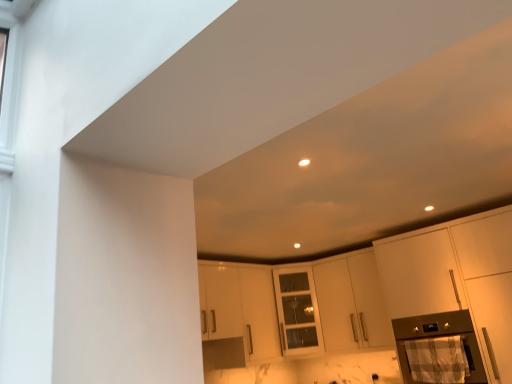
Question: Is metallic stainless steel oven at lower right facing away from matte white cabinet at right, which is the second cabinetry in back-to-front order?

Choices:
 (A) no
 (B) yes

Answer: (B)

Question: Is metallic stainless steel oven at lower right behind matte white cabinet at right, arranged as the 1th cabinetry when viewed from the front?

Choices:
 (A) yes
 (B) no

Answer: (A)

Question: From a real-world perspective, does metallic stainless steel oven at lower right sit lower than matte white cabinet at right, arranged as the 1th cabinetry when viewed from the front?

Choices:
 (A) no
 (B) yes

Answer: (B)

Question: Considering the relative sizes of metallic stainless steel oven at lower right and matte white cabinet at right, which is the second cabinetry in back-to-front order, in the image provided, is metallic stainless steel oven at lower right bigger than matte white cabinet at right, which is the second cabinetry in back-to-front order,?

Choices:
 (A) no
 (B) yes

Answer: (A)

Question: Is metallic stainless steel oven at lower right not near matte white cabinet at right, which is the second cabinetry in back-to-front order?

Choices:
 (A) no
 (B) yes

Answer: (A)

Question: From a real-world perspective, is white matte cabinet at center, the first cabinetry in the back-to-front sequence, physically located above or below matte white cabinet at right, which is the second cabinetry in back-to-front order?

Choices:
 (A) above
 (B) below

Answer: (A)

Question: Visually, is white matte cabinet at center, positioned as the second cabinetry in front-to-back order, positioned to the left or to the right of matte white cabinet at right, which is the second cabinetry in back-to-front order?

Choices:
 (A) right
 (B) left

Answer: (B)

Question: Considering the positions of point (364, 334) and point (480, 329), is point (364, 334) closer or farther from the camera than point (480, 329)?

Choices:
 (A) farther
 (B) closer

Answer: (A)

Question: From the image's perspective, is white matte cabinet at center, the first cabinetry in the back-to-front sequence, above or below matte white cabinet at right, which is the second cabinetry in back-to-front order?

Choices:
 (A) above
 (B) below

Answer: (B)

Question: In terms of width, does white matte cabinet at center, positioned as the second cabinetry in front-to-back order, look wider or thinner when compared to metallic stainless steel oven at lower right?

Choices:
 (A) thin
 (B) wide

Answer: (A)

Question: Considering the positions of white matte cabinet at center, positioned as the second cabinetry in front-to-back order, and metallic stainless steel oven at lower right in the image, is white matte cabinet at center, positioned as the second cabinetry in front-to-back order, bigger or smaller than metallic stainless steel oven at lower right?

Choices:
 (A) big
 (B) small

Answer: (A)

Question: From the image's perspective, is white matte cabinet at center, positioned as the second cabinetry in front-to-back order, positioned above or below metallic stainless steel oven at lower right?

Choices:
 (A) below
 (B) above

Answer: (B)

Question: From their relative heights in the image, would you say white matte cabinet at center, positioned as the second cabinetry in front-to-back order, is taller or shorter than metallic stainless steel oven at lower right?

Choices:
 (A) tall
 (B) short

Answer: (A)

Question: Looking at the image, does matte white cabinet at right, arranged as the 1th cabinetry when viewed from the front, seem bigger or smaller compared to white matte cabinet at center, positioned as the second cabinetry in front-to-back order?

Choices:
 (A) small
 (B) big

Answer: (B)

Question: From a real-world perspective, is matte white cabinet at right, arranged as the 1th cabinetry when viewed from the front, above or below white matte cabinet at center, the first cabinetry in the back-to-front sequence?

Choices:
 (A) below
 (B) above

Answer: (A)